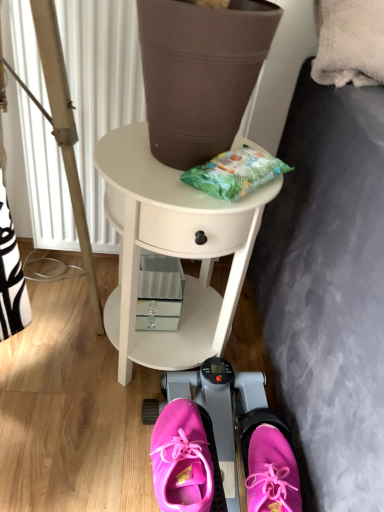
Identify the location of unoccupied space behind wooden tripod at left. (52, 263).